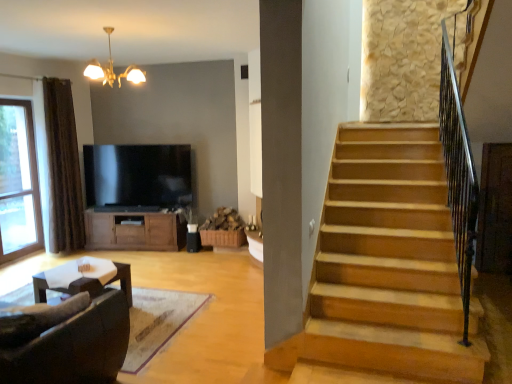
The height and width of the screenshot is (384, 512). Describe the element at coordinates (74, 347) in the screenshot. I see `dark brown leather couch at lower left` at that location.

What do you see at coordinates (112, 69) in the screenshot? This screenshot has height=384, width=512. I see `gold metallic chandelier at upper center` at bounding box center [112, 69].

This screenshot has height=384, width=512. Describe the element at coordinates (63, 168) in the screenshot. I see `brown fabric curtain at left` at that location.

Identify the location of transparent glass window at left. (18, 182).

Looking at this image, who is shorter, brown wood cabinet at center or flat screen tv at center?

brown wood cabinet at center is shorter.

Would you consider brown wood cabinet at center to be distant from flat screen tv at center?

No.

From a real-world perspective, which is physically below, brown wood cabinet at center or flat screen tv at center?

brown wood cabinet at center is physically lower.

Which is more to the right, brown wood cabinet at center or flat screen tv at center?

Positioned to the right is flat screen tv at center.

Considering the relative positions of gold metallic chandelier at upper center and brown fabric curtain at left in the image provided, is gold metallic chandelier at upper center behind brown fabric curtain at left?

No, it is not.

From the image's perspective, is gold metallic chandelier at upper center above or below brown fabric curtain at left?

gold metallic chandelier at upper center is situated higher than brown fabric curtain at left in the image.

Can you confirm if gold metallic chandelier at upper center is smaller than brown fabric curtain at left?

Yes, gold metallic chandelier at upper center is smaller than brown fabric curtain at left.

Which is less distant, (143,73) or (78,206)?

Point (143,73).

From a real-world perspective, is flat screen tv at center physically below brown fabric curtain at left?

Yes, from a real-world perspective, flat screen tv at center is beneath brown fabric curtain at left.

Is flat screen tv at center looking in the opposite direction of brown fabric curtain at left?

No, flat screen tv at center is not facing away from brown fabric curtain at left.

Can you confirm if flat screen tv at center is smaller than brown fabric curtain at left?

Correct, flat screen tv at center occupies less space than brown fabric curtain at left.

Considering the sizes of objects flat screen tv at center and transparent glass window at left in the image provided, who is bigger, flat screen tv at center or transparent glass window at left?

transparent glass window at left is bigger.

Would you say flat screen tv at center is a long distance from transparent glass window at left?

Indeed, flat screen tv at center is not near transparent glass window at left.

Locate an element on the screen. Image resolution: width=512 pixels, height=384 pixels. window below the flat screen tv at center (from the image's perspective) is located at coordinates (18, 182).

Which object is thinner, flat screen tv at center or transparent glass window at left?

Thinner between the two is flat screen tv at center.

Considering the relative sizes of flat screen tv at center and dark brown leather couch at lower left in the image provided, is flat screen tv at center smaller than dark brown leather couch at lower left?

Correct, flat screen tv at center occupies less space than dark brown leather couch at lower left.

In terms of width, does flat screen tv at center look wider or thinner when compared to dark brown leather couch at lower left?

Considering their sizes, flat screen tv at center looks slimmer than dark brown leather couch at lower left.

Is flat screen tv at center further to the viewer compared to dark brown leather couch at lower left?

Yes, flat screen tv at center is further from the viewer.

In terms of height, does gold metallic chandelier at upper center look taller or shorter compared to brown wood cabinet at center?

Considering their sizes, gold metallic chandelier at upper center has less height than brown wood cabinet at center.

Which object is positioned more to the right, gold metallic chandelier at upper center or brown wood cabinet at center?

gold metallic chandelier at upper center is more to the right.

Does gold metallic chandelier at upper center lie in front of brown wood cabinet at center?

Yes.

From a real-world perspective, which object rests below the other?

In real-world perspective, brown wood cabinet at center is lower.

Is brown wood cabinet at center oriented towards dark brown leather couch at lower left?

Yes, brown wood cabinet at center is turned towards dark brown leather couch at lower left.

Considering the relative sizes of brown wood cabinet at center and dark brown leather couch at lower left in the image provided, is brown wood cabinet at center shorter than dark brown leather couch at lower left?

Correct, brown wood cabinet at center is not as tall as dark brown leather couch at lower left.

Is brown wood cabinet at center to the right of dark brown leather couch at lower left from the viewer's perspective?

No, brown wood cabinet at center is not to the right of dark brown leather couch at lower left.

The width and height of the screenshot is (512, 384). I want to click on studio couch on the right of the brown wood cabinet at center, so click(x=74, y=347).

You are a GUI agent. You are given a task and a screenshot of the screen. Output one action in this format:
    pyautogui.click(x=<x>, y=<y>)
    Task: Click on the television located on the right of brown wood cabinet at center
    
    Given the screenshot: What is the action you would take?
    pyautogui.click(x=139, y=176)

The height and width of the screenshot is (384, 512). I want to click on curtain on the left of gold metallic chandelier at upper center, so click(x=63, y=168).

Considering their positions, is dark brown leather couch at lower left positioned further to brown fabric curtain at left than gold metallic chandelier at upper center?

dark brown leather couch at lower left is further to brown fabric curtain at left.

Considering their positions, is brown wood cabinet at center positioned further to gold metallic chandelier at upper center than brown fabric curtain at left?

Based on the image, brown wood cabinet at center appears to be further to gold metallic chandelier at upper center.

Looking at the image, which one is located further to gold metallic chandelier at upper center, transparent glass window at left or brown wood cabinet at center?

The object further to gold metallic chandelier at upper center is brown wood cabinet at center.

Based on their spatial positions, is flat screen tv at center or gold metallic chandelier at upper center closer to brown fabric curtain at left?

Among the two, flat screen tv at center is located nearer to brown fabric curtain at left.

Looking at the image, which one is located closer to dark brown leather couch at lower left, brown fabric curtain at left or flat screen tv at center?

brown fabric curtain at left is closer to dark brown leather couch at lower left.

Considering their positions, is flat screen tv at center positioned further to brown fabric curtain at left than dark brown leather couch at lower left?

Among the two, dark brown leather couch at lower left is located further to brown fabric curtain at left.

From the image, which object appears to be farther from transparent glass window at left, flat screen tv at center or dark brown leather couch at lower left?

dark brown leather couch at lower left is further to transparent glass window at left.

Considering their positions, is brown fabric curtain at left positioned closer to brown wood cabinet at center than flat screen tv at center?

Based on the image, flat screen tv at center appears to be nearer to brown wood cabinet at center.

Locate an element on the screen. This screenshot has height=384, width=512. cabinetry between transparent glass window at left and flat screen tv at center in the horizontal direction is located at coordinates (134, 231).

Find the location of a particular element. window between dark brown leather couch at lower left and flat screen tv at center along the z-axis is located at coordinates (18, 182).

Where is `curtain between gold metallic chandelier at upper center and brown wood cabinet at center along the z-axis`? The image size is (512, 384). curtain between gold metallic chandelier at upper center and brown wood cabinet at center along the z-axis is located at coordinates (63, 168).

What are the coordinates of `cabinetry between gold metallic chandelier at upper center and flat screen tv at center along the z-axis` in the screenshot? It's located at (134, 231).